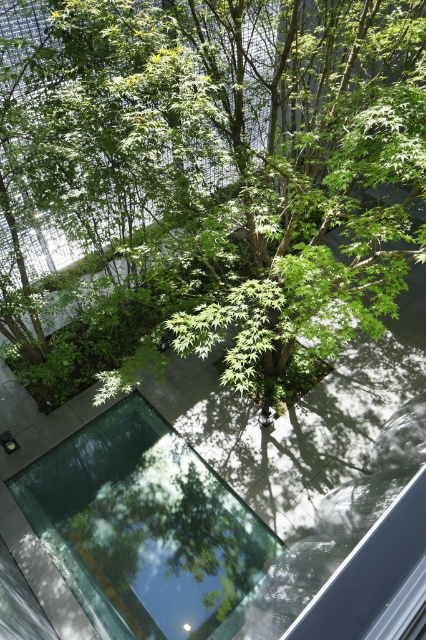
You are standing in the indoor garden and want to take a photo of the green leafy tree at center. If you are positioned at point 0.261, 0.556, would you be directly in front of the tree?

The green leafy tree at center is located at point (x=236, y=166), so if you are positioned at that exact point, you would be directly in front of the tree.

You are an architect designing a new indoor garden and want to ensure the green leafy tree at center and the transparent glass pool at center are placed correctly. Based on the scene description, which object is shorter in height?

The green leafy tree at center is shorter in height compared to the transparent glass pool at center according to the description.

You are a gardener who wants to water the green leafy tree at center and the transparent glass pool at center. Since the pool is transparent, you can see the tree reflected in it. Which object should you water directly to ensure both are properly cared for?

You should water the green leafy tree at center directly because it is located above the transparent glass pool at center, and the pool requires water maintenance rather than direct watering.